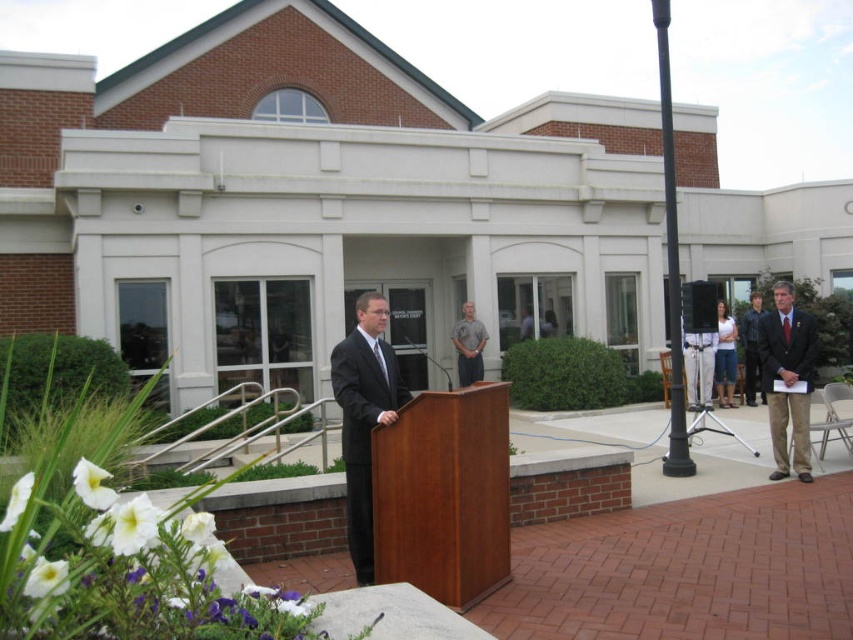
Where is `cherry wood podium at center`? This screenshot has height=640, width=853. cherry wood podium at center is located at coordinates (444, 493).

Does point (410, 422) come in front of point (399, 378)?

Yes, it is in front of point (399, 378).

Who is more distant from viewer, (425, 481) or (399, 394)?

The point (399, 394) is behind.

What are the coordinates of `cherry wood podium at center` in the screenshot? It's located at (444, 493).

Between dark brown suit at right and gray cotton shirt at center, which one has more height?

dark brown suit at right is taller.

Does dark brown suit at right have a greater width compared to gray cotton shirt at center?

In fact, dark brown suit at right might be narrower than gray cotton shirt at center.

Does point (761, 364) come farther from viewer compared to point (459, 321)?

No, it is not.

At what (x,y) coordinates should I click in order to perform the action: click on dark brown suit at right. Please return your answer as a coordinate pair (x, y). The image size is (853, 640). Looking at the image, I should click on (787, 378).

Does dark gray suit at center come behind dark blue leather jacket at right?

No, dark gray suit at center is in front of dark blue leather jacket at right.

Between dark gray suit at center and dark blue leather jacket at right, which one has less height?

Standing shorter between the two is dark gray suit at center.

At what (x,y) coordinates should I click in order to perform the action: click on dark gray suit at center. Please return your answer as a coordinate pair (x, y). Looking at the image, I should click on (364, 417).

You are a GUI agent. You are given a task and a screenshot of the screen. Output one action in this format:
    pyautogui.click(x=<x>, y=<y>)
    Task: Click on the dark gray suit at center
    
    Given the screenshot: What is the action you would take?
    pyautogui.click(x=364, y=417)